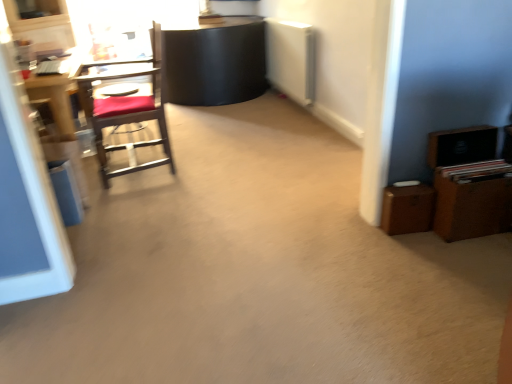
Question: From the image's perspective, is brown wooden dresser at right below wooden desk at left?

Choices:
 (A) no
 (B) yes

Answer: (B)

Question: Can you confirm if brown wooden dresser at right is bigger than wooden desk at left?

Choices:
 (A) yes
 (B) no

Answer: (B)

Question: Could you tell me if brown wooden dresser at right is facing wooden desk at left?

Choices:
 (A) yes
 (B) no

Answer: (B)

Question: Does brown wooden dresser at right have a smaller size compared to wooden desk at left?

Choices:
 (A) yes
 (B) no

Answer: (A)

Question: Is brown wooden dresser at right not within wooden desk at left?

Choices:
 (A) no
 (B) yes

Answer: (B)

Question: In terms of height, does wooden chair with red cushion at left look taller or shorter compared to brown wooden dresser at right?

Choices:
 (A) tall
 (B) short

Answer: (A)

Question: Choose the correct answer: Is wooden chair with red cushion at left inside brown wooden dresser at right or outside it?

Choices:
 (A) inside
 (B) outside

Answer: (B)

Question: Considering the positions of point (104, 74) and point (501, 168), is point (104, 74) closer or farther from the camera than point (501, 168)?

Choices:
 (A) closer
 (B) farther

Answer: (B)

Question: Based on their sizes in the image, would you say wooden chair with red cushion at left is bigger or smaller than brown wooden dresser at right?

Choices:
 (A) small
 (B) big

Answer: (B)

Question: Is wooden desk at left to the left or to the right of wooden chair with red cushion at left in the image?

Choices:
 (A) left
 (B) right

Answer: (A)

Question: Is wooden desk at left taller or shorter than wooden chair with red cushion at left?

Choices:
 (A) short
 (B) tall

Answer: (A)

Question: From the image's perspective, is wooden desk at left positioned above or below wooden chair with red cushion at left?

Choices:
 (A) below
 (B) above

Answer: (B)

Question: From a real-world perspective, is wooden desk at left positioned above or below wooden chair with red cushion at left?

Choices:
 (A) below
 (B) above

Answer: (A)

Question: Considering the positions of wooden desk at left and brown wooden dresser at right in the image, is wooden desk at left wider or thinner than brown wooden dresser at right?

Choices:
 (A) wide
 (B) thin

Answer: (A)

Question: In the image, is wooden desk at left on the left side or the right side of brown wooden dresser at right?

Choices:
 (A) left
 (B) right

Answer: (A)